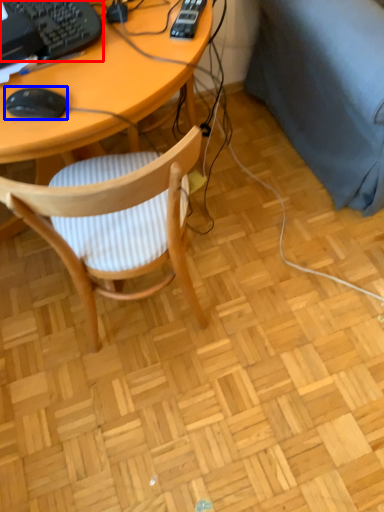
Question: Among these objects, which one is nearest to the camera, computer keyboard (highlighted by a red box) or mouse (highlighted by a blue box)?

Choices:
 (A) computer keyboard
 (B) mouse

Answer: (B)